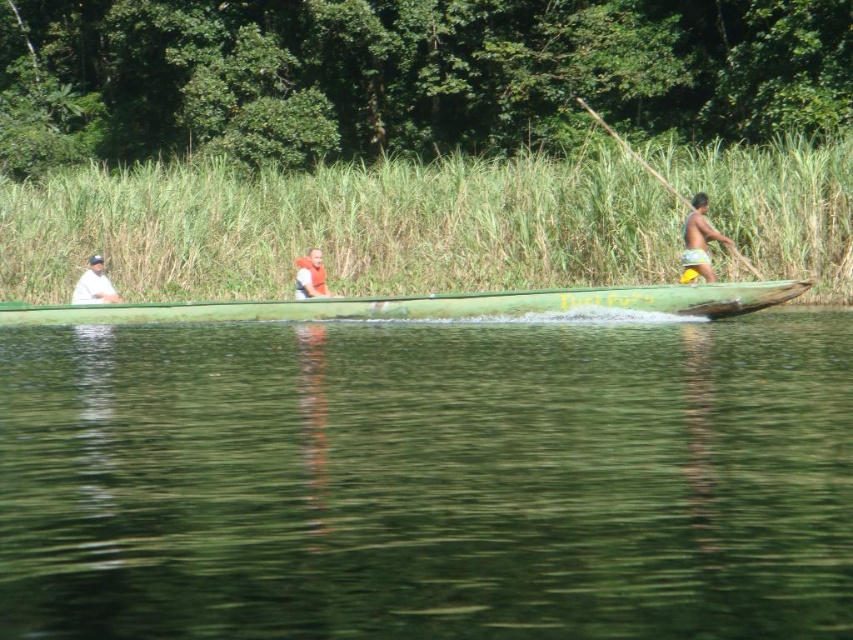
Question: Based on their relative distances, which object is nearer to the green smooth water at center?

Choices:
 (A) white fabric shirt at left
 (B) yellow fabric shorts at right

Answer: (B)

Question: Is green wooden boat at center to the left of white fabric shirt at left from the viewer's perspective?

Choices:
 (A) no
 (B) yes

Answer: (A)

Question: Is green wooden boat at center positioned before wooden paddle at right?

Choices:
 (A) yes
 (B) no

Answer: (A)

Question: Can you confirm if orange life vest at center is wider than wooden paddle at right?

Choices:
 (A) yes
 (B) no

Answer: (B)

Question: Which of these objects is positioned closest to the yellow fabric shorts at right?

Choices:
 (A) green smooth water at center
 (B) wooden paddle at right
 (C) green wooden boat at center
 (D) white fabric shirt at left

Answer: (C)

Question: Which object is the closest to the white fabric shirt at left?

Choices:
 (A) green wooden boat at center
 (B) green smooth water at center

Answer: (A)